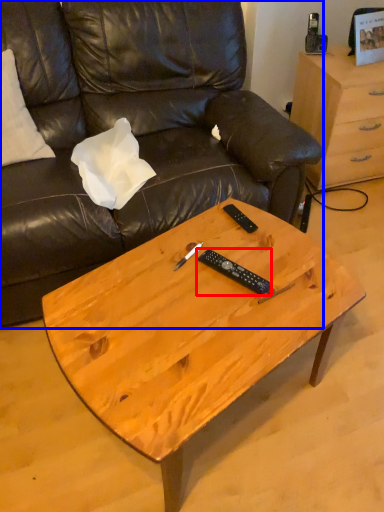
Question: Among these objects, which one is farthest to the camera, remote (highlighted by a red box) or studio couch (highlighted by a blue box)?

Choices:
 (A) remote
 (B) studio couch

Answer: (A)